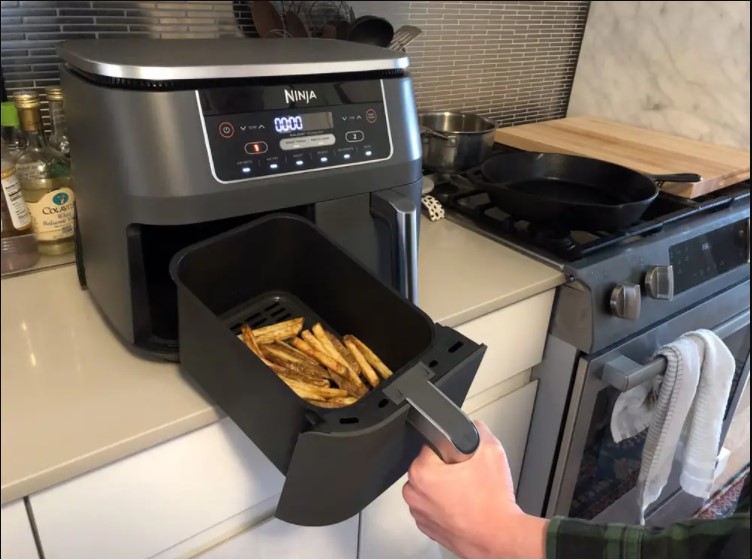
This screenshot has width=752, height=560. I want to click on butcher block, so click(x=617, y=140).